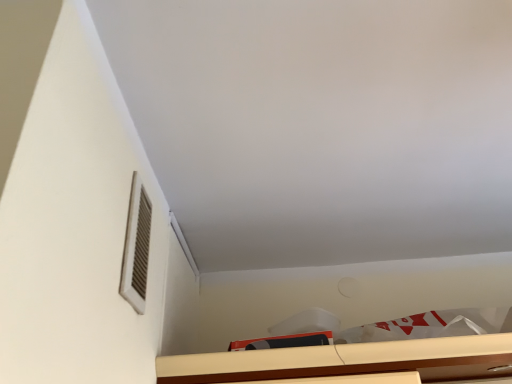
What do you see at coordinates (136, 247) in the screenshot? I see `white matte vent at upper left` at bounding box center [136, 247].

In order to face white matte vent at upper left, should I rotate leftwards or rightwards?

You should look left and rotate roughly 15.302 degrees.

This screenshot has height=384, width=512. I want to click on white matte vent at upper left, so click(x=136, y=247).

This screenshot has width=512, height=384. In order to click on wooden cabinet at lower center in this screenshot , I will do `click(347, 361)`.

What do you see at coordinates (347, 361) in the screenshot? The width and height of the screenshot is (512, 384). I see `wooden cabinet at lower center` at bounding box center [347, 361].

At what (x,y) coordinates should I click in order to perform the action: click on white matte vent at upper left. Please return your answer as a coordinate pair (x, y). Image resolution: width=512 pixels, height=384 pixels. Looking at the image, I should click on point(136,247).

Between white matte vent at upper left and wooden cabinet at lower center, which one appears on the right side from the viewer's perspective?

From the viewer's perspective, wooden cabinet at lower center appears more on the right side.

Between white matte vent at upper left and wooden cabinet at lower center, which one is positioned in front?

white matte vent at upper left is in front.

Is point (124, 292) in front of point (242, 368)?

Yes, point (124, 292) is in front of point (242, 368).

From the image's perspective, which is above, white matte vent at upper left or wooden cabinet at lower center?

white matte vent at upper left is shown above in the image.

From a real-world perspective, is white matte vent at upper left located higher than wooden cabinet at lower center?

Yes, from a real-world perspective, white matte vent at upper left is over wooden cabinet at lower center

Looking at this image, can you confirm if white matte vent at upper left is wider than wooden cabinet at lower center?

No, white matte vent at upper left is not wider than wooden cabinet at lower center.

Considering the sizes of objects white matte vent at upper left and wooden cabinet at lower center in the image provided, who is shorter, white matte vent at upper left or wooden cabinet at lower center?

With less height is wooden cabinet at lower center.

In terms of size, does white matte vent at upper left appear bigger or smaller than wooden cabinet at lower center?

Considering their sizes, white matte vent at upper left takes up less space than wooden cabinet at lower center.

Can we say white matte vent at upper left lies outside wooden cabinet at lower center?

white matte vent at upper left is positioned outside wooden cabinet at lower center.

Is white matte vent at upper left not close to wooden cabinet at lower center?

No, white matte vent at upper left is not far from wooden cabinet at lower center.

Looking at this image, is white matte vent at upper left oriented towards wooden cabinet at lower center?

No.

This screenshot has height=384, width=512. What are the coordinates of `window on the left of the wooden cabinet at lower center` in the screenshot? It's located at (136, 247).

Can you confirm if wooden cabinet at lower center is positioned to the left of white matte vent at upper left?

In fact, wooden cabinet at lower center is to the right of white matte vent at upper left.

Is wooden cabinet at lower center closer to camera compared to white matte vent at upper left?

No, wooden cabinet at lower center is further to the viewer.

Does point (337, 366) come farther from viewer compared to point (130, 227)?

That is True.

From the image's perspective, does wooden cabinet at lower center appear lower than white matte vent at upper left?

Yes.

From a real-world perspective, does wooden cabinet at lower center stand above white matte vent at upper left?

No.

Considering the sizes of objects wooden cabinet at lower center and white matte vent at upper left in the image provided, who is thinner, wooden cabinet at lower center or white matte vent at upper left?

Thinner between the two is white matte vent at upper left.

Can you confirm if wooden cabinet at lower center is shorter than white matte vent at upper left?

Correct, wooden cabinet at lower center is not as tall as white matte vent at upper left.

Based on their sizes in the image, would you say wooden cabinet at lower center is bigger or smaller than white matte vent at upper left?

Clearly, wooden cabinet at lower center is larger in size than white matte vent at upper left.

Is wooden cabinet at lower center surrounding white matte vent at upper left?

No, wooden cabinet at lower center does not contain white matte vent at upper left.

Is wooden cabinet at lower center far away from white matte vent at upper left?

wooden cabinet at lower center is actually quite close to white matte vent at upper left.

Is wooden cabinet at lower center aimed at white matte vent at upper left?

No.

How much distance is there between wooden cabinet at lower center and white matte vent at upper left?

wooden cabinet at lower center and white matte vent at upper left are 16.65 inches apart.

This screenshot has height=384, width=512. I want to click on window above the wooden cabinet at lower center (from a real-world perspective), so click(136, 247).

The image size is (512, 384). I want to click on window above the wooden cabinet at lower center (from a real-world perspective), so click(x=136, y=247).

I want to click on cabinetry that appears below the white matte vent at upper left (from the image's perspective), so click(x=347, y=361).